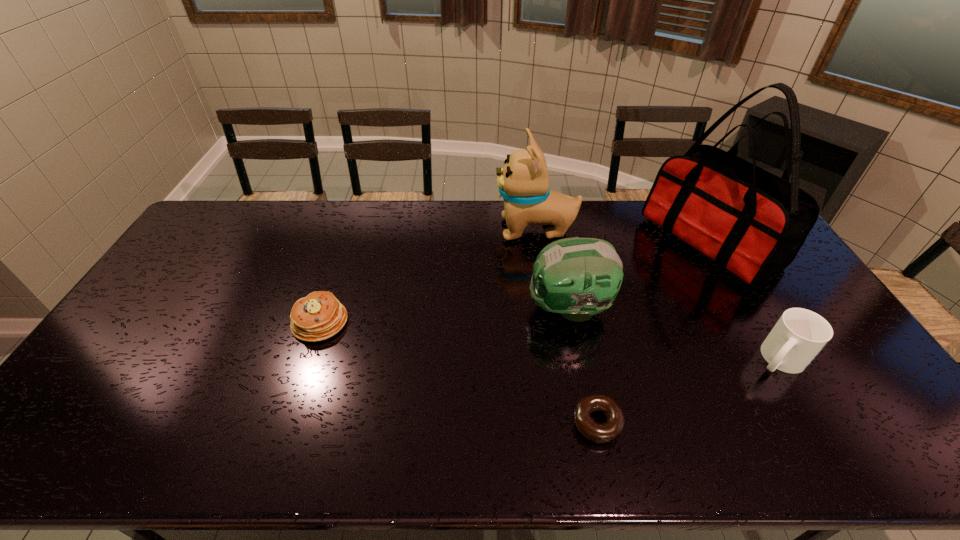
The image size is (960, 540). In order to click on object positioned at the near edge in this screenshot , I will do `click(601, 433)`.

Locate an element on the screen. This screenshot has width=960, height=540. duffel bag that is positioned at the right edge is located at coordinates [752, 223].

At what (x,y) coordinates should I click in order to perform the action: click on mug that is at the right edge. Please return your answer as a coordinate pair (x, y). This screenshot has width=960, height=540. Looking at the image, I should click on (799, 335).

The width and height of the screenshot is (960, 540). In order to click on object that is at the far right corner in this screenshot , I will do `click(752, 223)`.

In the image, there is a desktop. Find the location of `vacant space at the far edge`. vacant space at the far edge is located at coordinates (617, 237).

The height and width of the screenshot is (540, 960). Find the location of `vacant space at the near edge`. vacant space at the near edge is located at coordinates (701, 433).

What are the coordinates of `vacant space at the left edge of the desktop` in the screenshot? It's located at (181, 325).

This screenshot has height=540, width=960. What are the coordinates of `unoccupied area between the nearest object and the pancake` in the screenshot? It's located at click(459, 372).

The height and width of the screenshot is (540, 960). In order to click on unoccupied area between the third shortest object and the doughnut in this screenshot , I will do `click(687, 390)`.

Find the location of a particular element. This screenshot has width=960, height=540. free spot between the duffel bag and the second tallest object is located at coordinates (622, 236).